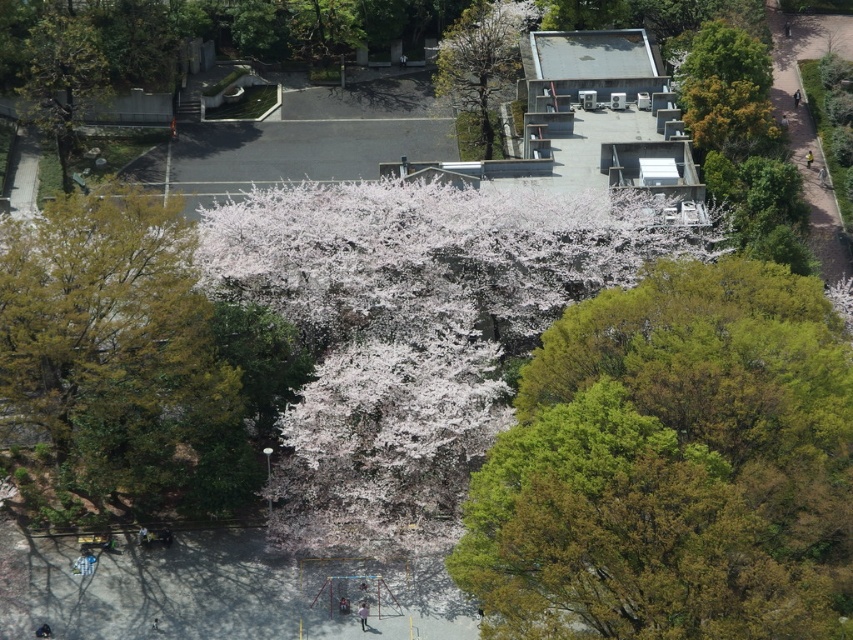
Question: Is white blossoms at center closer to camera compared to green leafy tree at lower left?

Choices:
 (A) yes
 (B) no

Answer: (B)

Question: Among these objects, which one is nearest to the camera?

Choices:
 (A) white blossoms at center
 (B) green leafy tree at lower left
 (C) smooth bark tree at upper center
 (D) green leafy tree at upper left

Answer: (B)

Question: In this image, where is green leafy tree at upper left located relative to smooth bark tree at upper center?

Choices:
 (A) left
 (B) right

Answer: (A)

Question: Can you confirm if green leafy tree at upper left is positioned to the right of smooth bark tree at upper center?

Choices:
 (A) yes
 (B) no

Answer: (B)

Question: Which object is closer to the camera taking this photo?

Choices:
 (A) green leafy tree at lower left
 (B) green leafy tree at center
 (C) white blossoms at center

Answer: (B)

Question: Estimate the real-world distances between objects in this image. Which object is farther from the green leafy tree at upper left?

Choices:
 (A) green leafy tree at lower left
 (B) green leafy tree at center

Answer: (B)